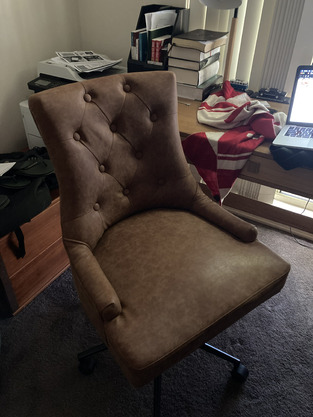
Identify the location of laptop keyboard. The height and width of the screenshot is (417, 313). (293, 133).